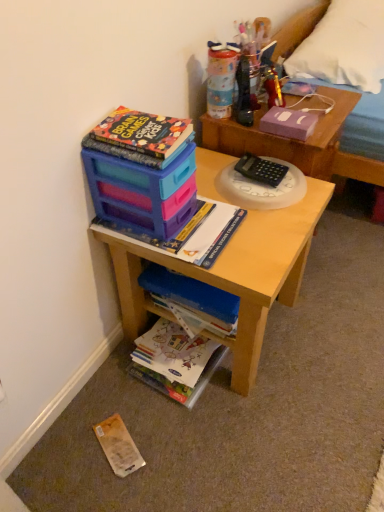
Question: Considering the relative sizes of colored paper art at lower center, arranged as the 1th book when ordered from the bottom, and yellow paper at lower left, which is the 2th paperback book in top-to-bottom order, in the image provided, is colored paper art at lower center, arranged as the 1th book when ordered from the bottom, smaller than yellow paper at lower left, which is the 2th paperback book in top-to-bottom order,?

Choices:
 (A) yes
 (B) no

Answer: (B)

Question: Is colored paper art at lower center, arranged as the 1th book when ordered from the bottom, at the right side of yellow paper at lower left, arranged as the first paperback book when ordered from the bottom?

Choices:
 (A) yes
 (B) no

Answer: (A)

Question: Is colored paper art at lower center, marked as the fourth book in a top-to-bottom arrangement, oriented away from yellow paper at lower left, arranged as the first paperback book when ordered from the bottom?

Choices:
 (A) yes
 (B) no

Answer: (B)

Question: Does colored paper art at lower center, arranged as the 1th book when ordered from the bottom, have a larger size compared to yellow paper at lower left, arranged as the first paperback book when ordered from the bottom?

Choices:
 (A) yes
 (B) no

Answer: (A)

Question: From a real-world perspective, does colored paper art at lower center, marked as the fourth book in a top-to-bottom arrangement, sit lower than yellow paper at lower left, positioned as the 1th paperback book in left-to-right order?

Choices:
 (A) no
 (B) yes

Answer: (A)

Question: From a real-world perspective, is metallic gold toy at upper right above or below purple matte paper at upper right, the 2th paperback book in the left-to-right sequence?

Choices:
 (A) above
 (B) below

Answer: (A)

Question: From the image's perspective, is metallic gold toy at upper right above or below purple matte paper at upper right, the 2th paperback book in the left-to-right sequence?

Choices:
 (A) above
 (B) below

Answer: (A)

Question: Is metallic gold toy at upper right spatially inside purple matte paper at upper right, positioned as the first paperback book in right-to-left order, or outside of it?

Choices:
 (A) outside
 (B) inside

Answer: (A)

Question: Relative to purple matte paper at upper right, the 2th paperback book in the left-to-right sequence, is metallic gold toy at upper right in front or behind?

Choices:
 (A) front
 (B) behind

Answer: (B)

Question: Considering the relative positions of blue matte book at center, acting as the third book starting from the top, and white fabric pillow at upper right in the image provided, is blue matte book at center, acting as the third book starting from the top, to the left or to the right of white fabric pillow at upper right?

Choices:
 (A) left
 (B) right

Answer: (A)

Question: Which is correct: blue matte book at center, acting as the third book starting from the top, is inside white fabric pillow at upper right, or outside of it?

Choices:
 (A) inside
 (B) outside

Answer: (B)

Question: In terms of width, does blue matte book at center, acting as the third book starting from the top, look wider or thinner when compared to white fabric pillow at upper right?

Choices:
 (A) wide
 (B) thin

Answer: (B)

Question: From their relative heights in the image, would you say blue matte book at center, acting as the third book starting from the top, is taller or shorter than white fabric pillow at upper right?

Choices:
 (A) short
 (B) tall

Answer: (A)

Question: Is metallic gold toy at upper right wider or thinner than yellow paper at lower left, the second paperback book when ordered from right to left?

Choices:
 (A) wide
 (B) thin

Answer: (B)

Question: Visually, is metallic gold toy at upper right positioned to the left or to the right of yellow paper at lower left, which is the 2th paperback book in top-to-bottom order?

Choices:
 (A) left
 (B) right

Answer: (B)